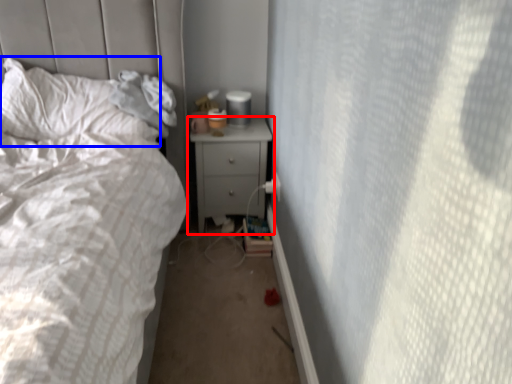
Question: Which object appears farthest to the camera in this image, nightstand (highlighted by a red box) or pillow (highlighted by a blue box)?

Choices:
 (A) nightstand
 (B) pillow

Answer: (A)